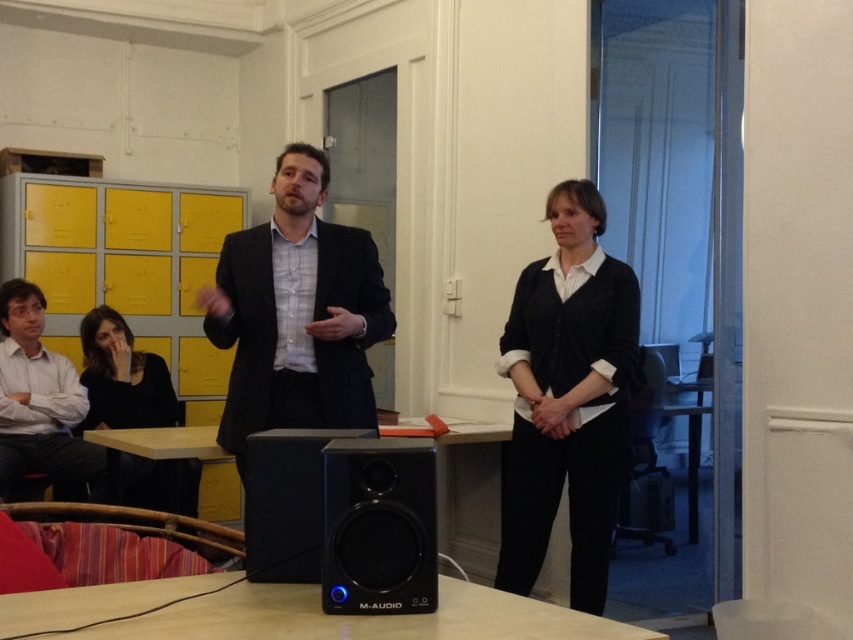
Is wooden table at center smaller than matte white shirt at lower left?

Indeed, wooden table at center has a smaller size compared to matte white shirt at lower left.

Is point (125, 637) behind point (0, 429)?

No.

Image resolution: width=853 pixels, height=640 pixels. In order to click on wooden table at center in this screenshot , I will do `click(289, 612)`.

Is matte white shirt at lower left closer to camera compared to matte black sweater at lower left?

Yes.

Does matte white shirt at lower left appear on the right side of matte black sweater at lower left?

No, matte white shirt at lower left is not to the right of matte black sweater at lower left.

What do you see at coordinates (39, 401) in the screenshot?
I see `matte white shirt at lower left` at bounding box center [39, 401].

Where is `matte white shirt at lower left`? matte white shirt at lower left is located at coordinates (39, 401).

Between matte white shirt at lower left and light brown wooden table at lower center, which one appears on the right side from the viewer's perspective?

light brown wooden table at lower center

You are a GUI agent. You are given a task and a screenshot of the screen. Output one action in this format:
    pyautogui.click(x=<x>, y=<y>)
    Task: Click on the matte white shirt at lower left
    The height and width of the screenshot is (640, 853).
    Given the screenshot: What is the action you would take?
    pyautogui.click(x=39, y=401)

Which is in front, point (15, 449) or point (148, 436)?

Positioned in front is point (148, 436).

Where is `matte white shirt at lower left`? The height and width of the screenshot is (640, 853). matte white shirt at lower left is located at coordinates (39, 401).